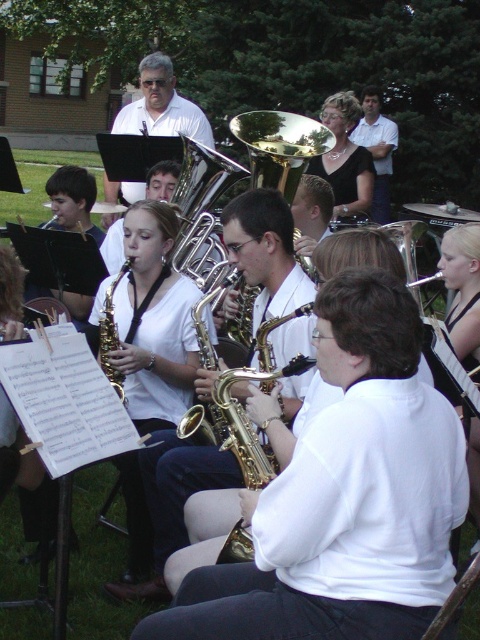
Who is more distant from viewer, [192,280] or [267,128]?

Point [267,128]

Consider the image. Does silver polished trumpet at center come in front of brass shiny trumpet at center?

Yes, it is in front of brass shiny trumpet at center.

Which is behind, point (214, 282) or point (253, 122)?

The point (253, 122) is more distant.

In order to click on silver polished trumpet at center in this screenshot , I will do `click(202, 211)`.

Between point (187, 202) and point (128, 262), which one is positioned in front?

Point (128, 262)

Between silver polished trumpet at center and gold shiny saxophone at center, which one appears on the left side from the viewer's perspective?

gold shiny saxophone at center

Which is behind, point (183, 147) or point (108, 369)?

Positioned behind is point (183, 147).

Locate an element on the screen. silver polished trumpet at center is located at coordinates [x=202, y=211].

From the picture: Between brass shiny trumpet at center and gold shiny saxophone at center, which one has less height?

brass shiny trumpet at center

Does brass shiny trumpet at center lie behind gold shiny saxophone at center?

Yes, brass shiny trumpet at center is further from the viewer.

Does point (291, 122) lie behind point (99, 362)?

Yes, point (291, 122) is behind point (99, 362).

Find the location of a particular element. brass shiny trumpet at center is located at coordinates (279, 147).